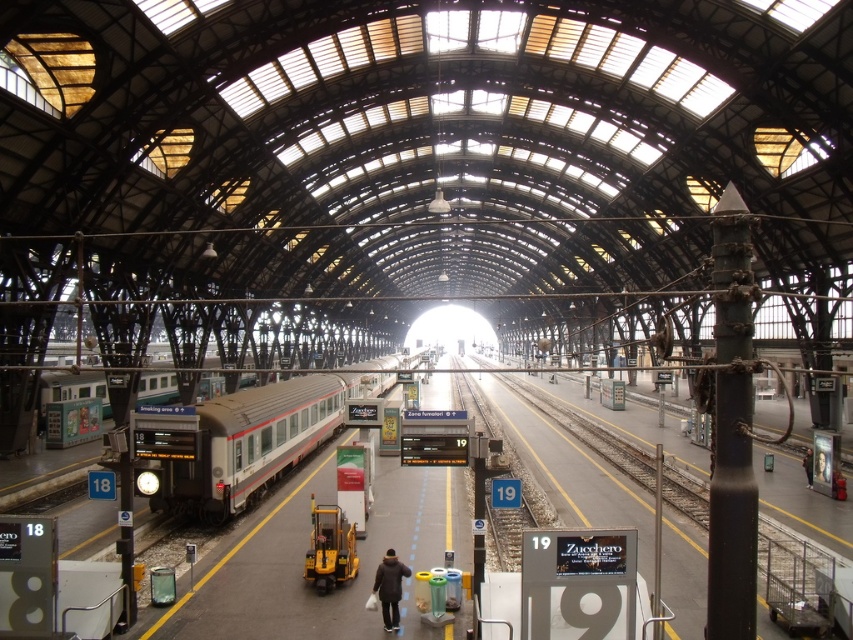
You are a passenger waiting at the train station. You see the silver metallic train at left and the dark brown leather jacket at center. Which object is closer to your current position if you are standing on the platform?

The silver metallic train at left is closer to your current position because it is positioned on the left side of the dark brown leather jacket at center, meaning it is nearer to the platform edge where passengers stand.

You are a passenger waiting at the train station. You see the silver metallic train at left and the dark brown leather jacket at center. Which object is bigger in size?

The silver metallic train at left is larger in size than the dark brown leather jacket at center.

You are a maintenance worker standing at the center of the platform near the black leather jacket at center. You need to inspect the silver metallic train at left. Can you walk directly to the train without crossing any yellow lines?

The silver metallic train at left is 31.49 meters away from the black leather jacket at center. Since the platform is wide and spacious with yellow lines guiding passengers towards the tracks, it is likely possible to walk directly to the train while staying within the designated areas and not crossing the yellow lines.